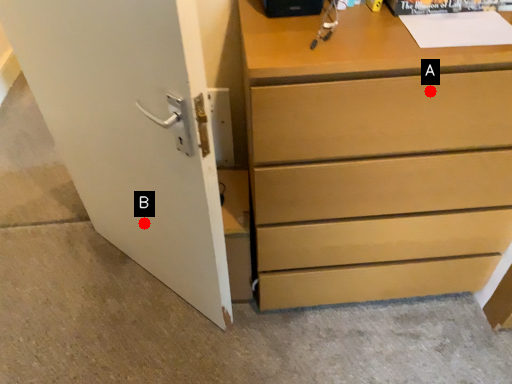
Question: Two points are circled on the image, labeled by A and B beside each circle. Which point is closer to the camera?

Choices:
 (A) A is closer
 (B) B is closer

Answer: (A)